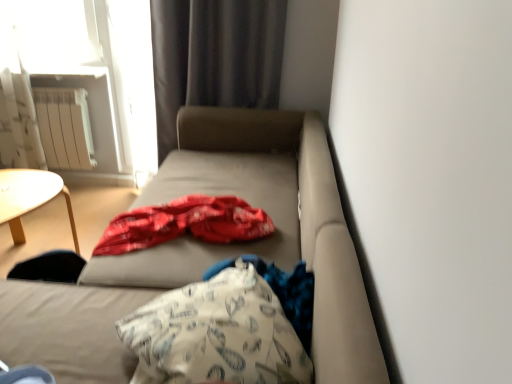
Question: Is matte beige studio couch at center thinner than dark gray fabric curtain at upper center?

Choices:
 (A) no
 (B) yes

Answer: (A)

Question: Is matte beige studio couch at center closer to camera compared to dark gray fabric curtain at upper center?

Choices:
 (A) no
 (B) yes

Answer: (B)

Question: Considering the relative sizes of matte beige studio couch at center and dark gray fabric curtain at upper center in the image provided, is matte beige studio couch at center shorter than dark gray fabric curtain at upper center?

Choices:
 (A) no
 (B) yes

Answer: (B)

Question: Considering the relative sizes of matte beige studio couch at center and dark gray fabric curtain at upper center in the image provided, is matte beige studio couch at center wider than dark gray fabric curtain at upper center?

Choices:
 (A) no
 (B) yes

Answer: (B)

Question: Does matte beige studio couch at center appear on the left side of dark gray fabric curtain at upper center?

Choices:
 (A) yes
 (B) no

Answer: (A)

Question: From a real-world perspective, relative to matte beige studio couch at center, is white fabric throw pillow at center vertically above or below?

Choices:
 (A) above
 (B) below

Answer: (A)

Question: Do you think white fabric throw pillow at center is within matte beige studio couch at center, or outside of it?

Choices:
 (A) inside
 (B) outside

Answer: (A)

Question: From their relative heights in the image, would you say white fabric throw pillow at center is taller or shorter than matte beige studio couch at center?

Choices:
 (A) short
 (B) tall

Answer: (A)

Question: In the image, is white fabric throw pillow at center positioned in front of or behind matte beige studio couch at center?

Choices:
 (A) front
 (B) behind

Answer: (B)

Question: Is point (157, 44) positioned closer to the camera than point (309, 339)?

Choices:
 (A) farther
 (B) closer

Answer: (A)

Question: Relative to white printed fabric at center, is dark gray fabric curtain at upper center in front or behind?

Choices:
 (A) front
 (B) behind

Answer: (B)

Question: Is dark gray fabric curtain at upper center inside or outside of white printed fabric at center?

Choices:
 (A) inside
 (B) outside

Answer: (B)

Question: In terms of height, does dark gray fabric curtain at upper center look taller or shorter compared to white printed fabric at center?

Choices:
 (A) tall
 (B) short

Answer: (A)

Question: From a real-world perspective, relative to white metallic radiator at upper left, is white printed fabric at center vertically above or below?

Choices:
 (A) below
 (B) above

Answer: (B)

Question: Looking at the image, does white printed fabric at center seem bigger or smaller compared to white metallic radiator at upper left?

Choices:
 (A) small
 (B) big

Answer: (B)